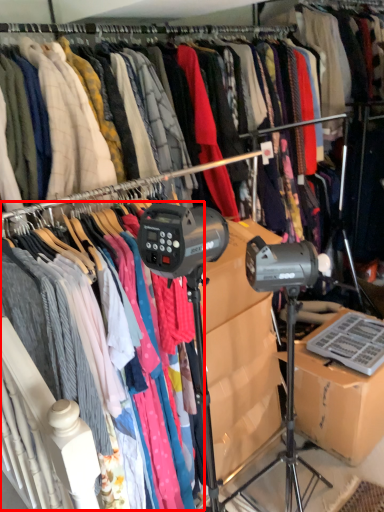
Question: From the image's perspective, where is clothing (annotated by the red box) located in relation to cardboard box in the image?

Choices:
 (A) above
 (B) below

Answer: (A)